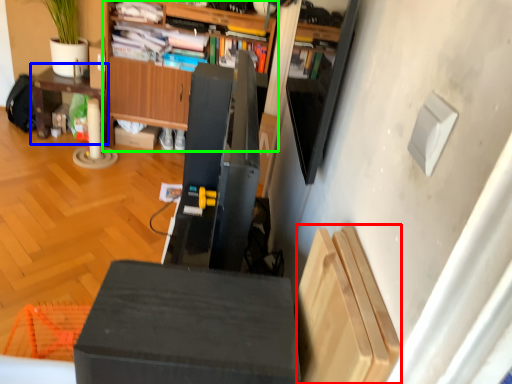
Question: Which is farther away from shelf (highlighted by a red box)? table (highlighted by a blue box) or cabinetry (highlighted by a green box)?

Choices:
 (A) table
 (B) cabinetry

Answer: (A)